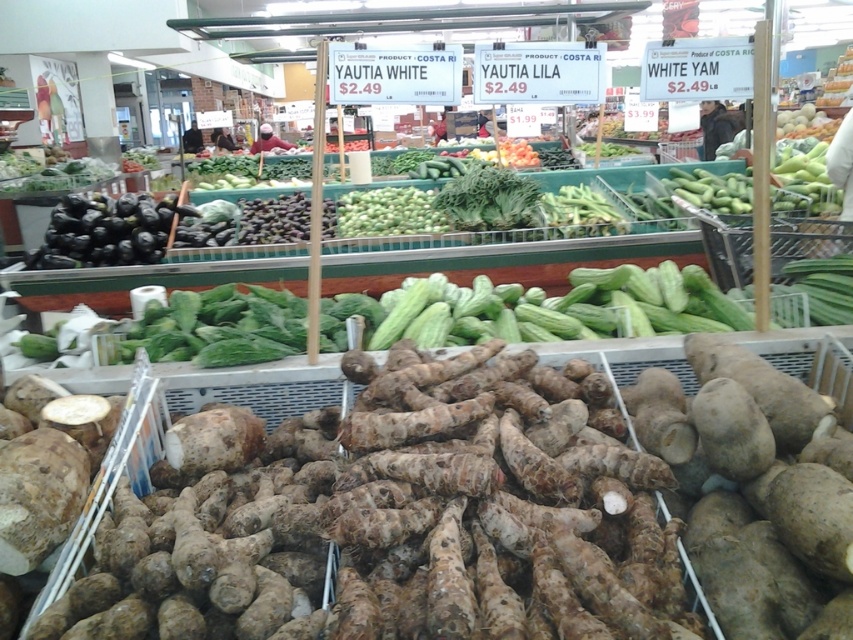
You are a customer in the market looking for the black matte eggplant at left and green matte cucumbers at center. Which one is positioned lower in the display?

The black matte eggplant at left is located below the green matte cucumbers at center, so it is positioned lower in the display.

You are a grocery shopper with a small basket that can only hold vegetables that are smaller than 10 inches in length. You see the black matte eggplant at left and the green matte cucumbers at center. Which vegetable should you choose to fit in your basket?

The green matte cucumbers at center are smaller than the black matte eggplant at left, so you should choose the green matte cucumbers at center to fit in your basket since they are under 10 inches.

You are a customer in the market and want to find the black matte eggplant at left. If you are standing at the origin point of the coordinate system, which direction should you move to reach it?

The black matte eggplant at left is located at coordinate point 0.362 on the x axis and 0.127 on the y axis. Since the x coordinate is positive, you should move to the right, and since the y coordinate is also positive, you should move forward to reach it.